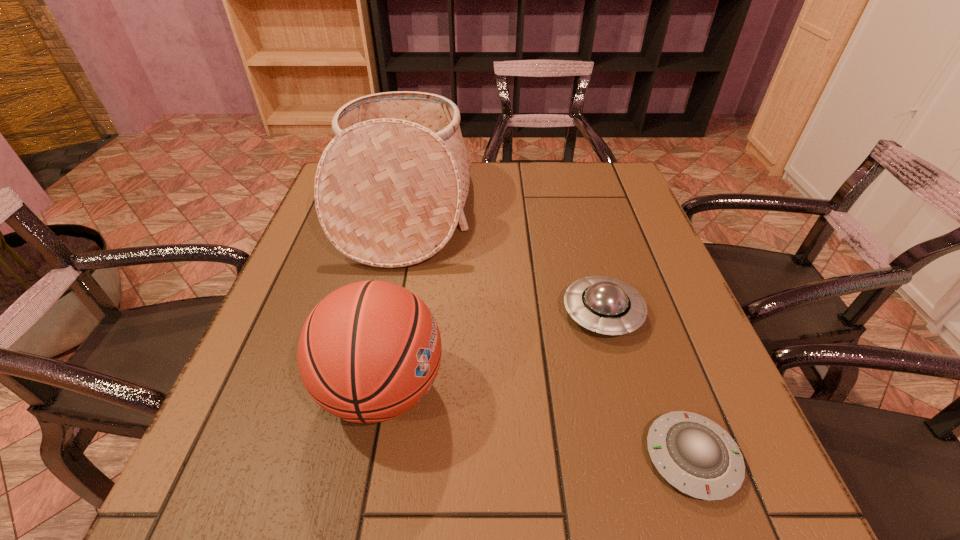
This screenshot has height=540, width=960. Identify the location of basket. (x=390, y=188).

The image size is (960, 540). I want to click on the farthest object, so [390, 188].

Locate an element on the screen. The width and height of the screenshot is (960, 540). basketball is located at coordinates (368, 352).

The image size is (960, 540). Find the location of `the second shortest object`. the second shortest object is located at coordinates (609, 306).

Find the location of a particular element. The image size is (960, 540). the taller saucer is located at coordinates (609, 306).

What are the coordinates of `the shortest object` in the screenshot? It's located at (695, 455).

This screenshot has height=540, width=960. I want to click on the nearer saucer, so click(x=695, y=455).

Locate an element on the screen. free point located 0.280m with the lid open on the farthest object is located at coordinates (575, 210).

This screenshot has width=960, height=540. In order to click on vacant space located on the logo side of the basketball in this screenshot , I will do `click(570, 389)`.

Locate an element on the screen. This screenshot has width=960, height=540. vacant space situated on the back of the farther saucer is located at coordinates (590, 270).